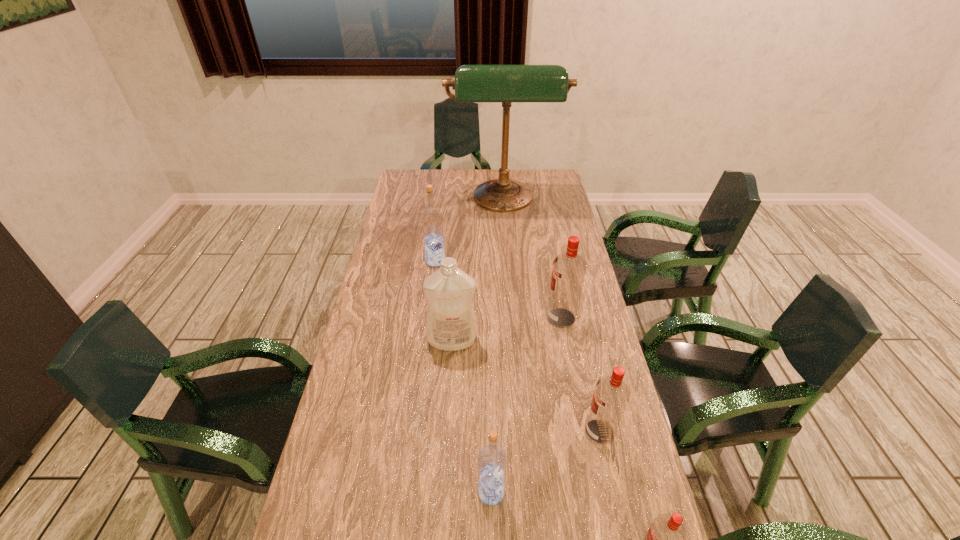
Locate an element on the screen. This screenshot has height=540, width=960. blank region between the farther blue vodka and the third nearest object is located at coordinates (517, 347).

The height and width of the screenshot is (540, 960). Find the location of `vacant point located between the second biggest red vodka and the fourth nearest vodka`. vacant point located between the second biggest red vodka and the fourth nearest vodka is located at coordinates (580, 375).

The image size is (960, 540). What are the coordinates of `free space between the second nearest object and the detergent` in the screenshot? It's located at (471, 416).

In order to click on vacant area that lies between the left blue vodka and the farthest red vodka in this screenshot , I will do `click(498, 289)`.

Where is `object that is the fourth nearest to the nearest red vodka`? object that is the fourth nearest to the nearest red vodka is located at coordinates (450, 321).

Choose which object is the second nearest neighbor to the left blue vodka. Please provide its 2D coordinates. Your answer should be formatted as a tuple, i.e. [(x, y)], where the tuple contains the x and y coordinates of a point satisfying the conditions above.

[(450, 321)]

Point out which vodka is positioned as the second nearest to the nearest object. Please provide its 2D coordinates. Your answer should be formatted as a tuple, i.e. [(x, y)], where the tuple contains the x and y coordinates of a point satisfying the conditions above.

[(492, 460)]

Identify which vodka is located as the fourth nearest to the second biggest red vodka. Please provide its 2D coordinates. Your answer should be formatted as a tuple, i.e. [(x, y)], where the tuple contains the x and y coordinates of a point satisfying the conditions above.

[(432, 223)]

I want to click on red vodka that stands as the second closest to the detergent, so click(611, 395).

Find the location of a particular element. This screenshot has width=960, height=540. red vodka object that ranks as the second closest to the tallest object is located at coordinates (611, 395).